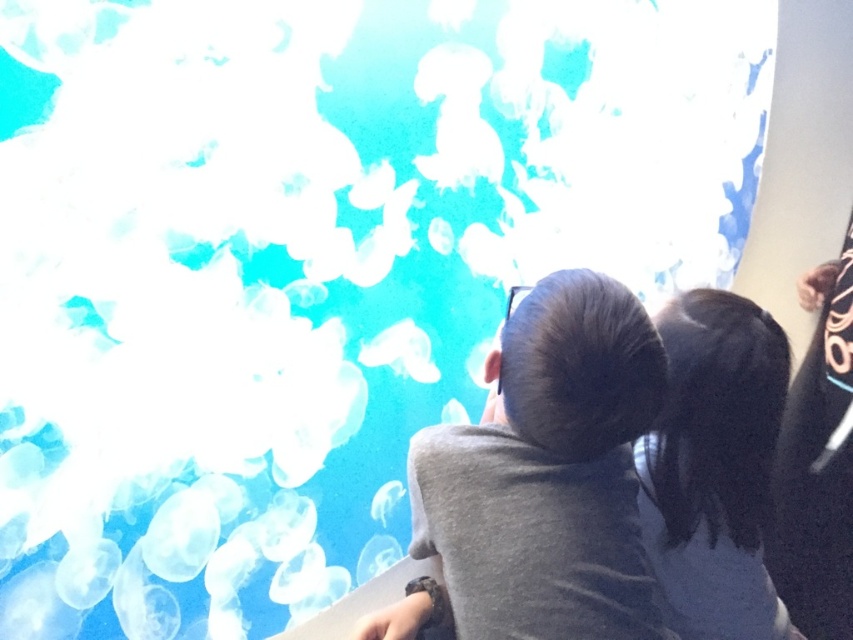
Does point (514, 442) come behind point (773, 323)?

No, it is in front of (773, 323).

Can you confirm if gray matte shirt at center is positioned to the left of black hair at upper right?

Indeed, gray matte shirt at center is positioned on the left side of black hair at upper right.

Is point (488, 566) farther from viewer compared to point (689, 330)?

No, (488, 566) is in front of (689, 330).

At what (x,y) coordinates should I click in order to perform the action: click on gray matte shirt at center. Please return your answer as a coordinate pair (x, y). The image size is (853, 640). Looking at the image, I should click on pyautogui.click(x=548, y=472).